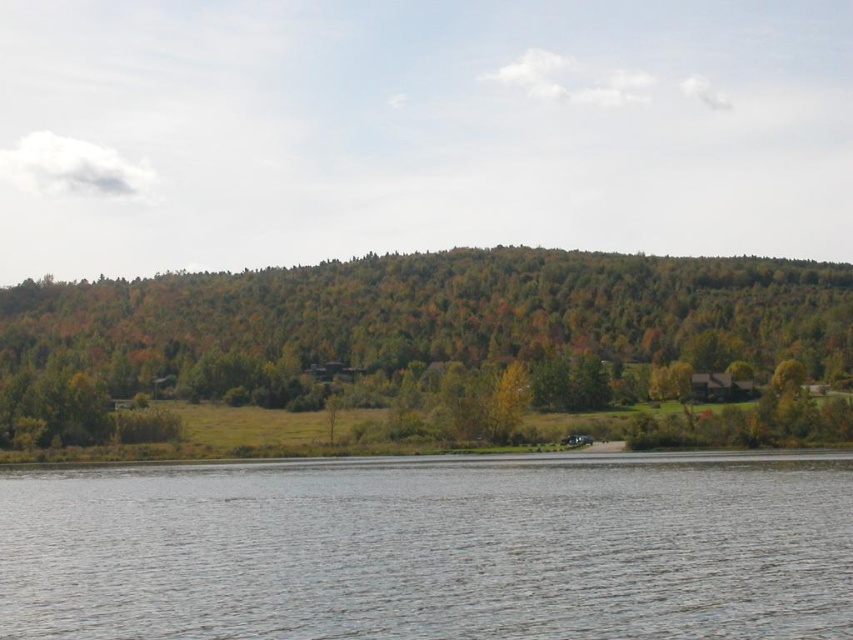
At what (x,y) coordinates should I click in order to perform the action: click on clear water at lower center. Please return your answer as a coordinate pair (x, y). Looking at the image, I should click on (432, 548).

Between point (403, 563) and point (77, 326), which one is positioned behind?

Positioned behind is point (77, 326).

Measure the distance between point (699, 557) and camera.

They are 51.90 meters apart.

Where is `clear water at lower center`? clear water at lower center is located at coordinates (432, 548).